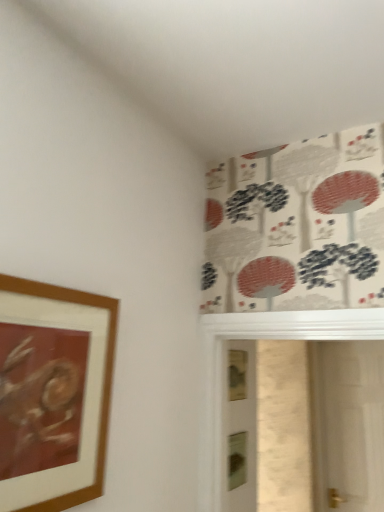
Question: From the image's perspective, is transparent glass screen door at right located above or below wooden picture frame at left?

Choices:
 (A) below
 (B) above

Answer: (A)

Question: Do you think transparent glass screen door at right is within wooden picture frame at left, or outside of it?

Choices:
 (A) inside
 (B) outside

Answer: (B)

Question: From a real-world perspective, is transparent glass screen door at right physically located above or below wooden picture frame at left?

Choices:
 (A) above
 (B) below

Answer: (B)

Question: Considering the positions of wooden picture frame at left and transparent glass screen door at right in the image, is wooden picture frame at left wider or thinner than transparent glass screen door at right?

Choices:
 (A) wide
 (B) thin

Answer: (B)

Question: Would you say wooden picture frame at left is to the left or to the right of transparent glass screen door at right in the picture?

Choices:
 (A) left
 (B) right

Answer: (A)

Question: Is wooden picture frame at left in front of or behind transparent glass screen door at right in the image?

Choices:
 (A) behind
 (B) front

Answer: (B)

Question: In terms of height, does wooden picture frame at left look taller or shorter compared to transparent glass screen door at right?

Choices:
 (A) short
 (B) tall

Answer: (A)